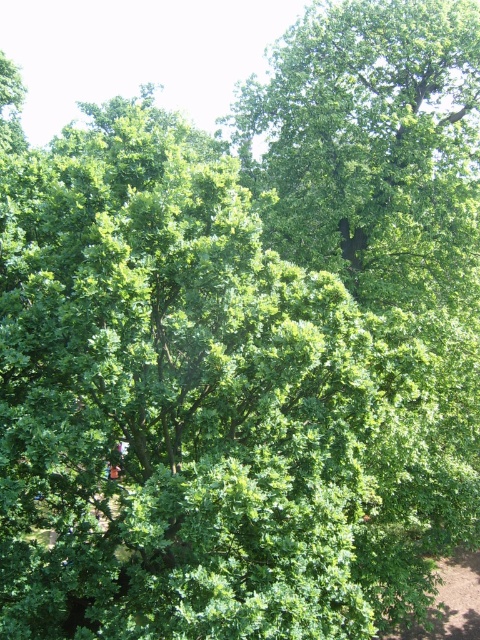
Question: Which of the following is the closest to the observer?

Choices:
 (A) brown dirt path at lower right
 (B) green leafy tree at upper center

Answer: (A)

Question: Does green leafy tree at upper center have a greater width compared to brown dirt path at lower right?

Choices:
 (A) no
 (B) yes

Answer: (A)

Question: Considering the relative positions of green leafy tree at upper center and brown dirt path at lower right in the image provided, where is green leafy tree at upper center located with respect to brown dirt path at lower right?

Choices:
 (A) below
 (B) above

Answer: (B)

Question: Does green leafy tree at upper center appear under brown dirt path at lower right?

Choices:
 (A) yes
 (B) no

Answer: (B)

Question: Which point is closer to the camera?

Choices:
 (A) green leafy tree at upper center
 (B) brown dirt path at lower right

Answer: (B)